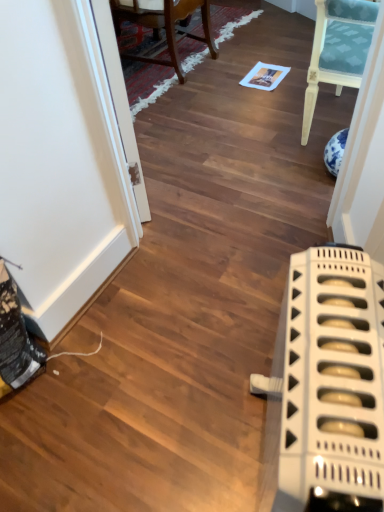
What do you see at coordinates (116, 94) in the screenshot? The width and height of the screenshot is (384, 512). I see `transparent glass door at upper left` at bounding box center [116, 94].

You are a GUI agent. You are given a task and a screenshot of the screen. Output one action in this format:
    pyautogui.click(x=<x>, y=<y>)
    Task: Click on the white plastic radiator at lower right
    Image resolution: width=384 pixels, height=512 pixels.
    Given the screenshot: What is the action you would take?
    pyautogui.click(x=332, y=379)

Locate an element on the screen. wooden chair at upper center is located at coordinates (165, 27).

Considering the relative sizes of white plastic radiator at lower right and transparent glass door at upper left in the image provided, is white plastic radiator at lower right wider than transparent glass door at upper left?

Yes, white plastic radiator at lower right is wider than transparent glass door at upper left.

Looking at this image, is white plastic radiator at lower right completely or partially outside of transparent glass door at upper left?

Indeed, white plastic radiator at lower right is completely outside transparent glass door at upper left.

Identify the location of appliance in front of the transparent glass door at upper left. (332, 379).

Considering the positions of objects white plastic radiator at lower right and transparent glass door at upper left in the image provided, who is more to the left, white plastic radiator at lower right or transparent glass door at upper left?

From the viewer's perspective, transparent glass door at upper left appears more on the left side.

Which is more distant, (156, 61) or (109, 18)?

Point (156, 61)

In the scene shown: Is transparent glass door at upper left inside wooden chair at upper center?

No, wooden chair at upper center does not contain transparent glass door at upper left.

From a real-world perspective, between wooden chair at upper center and transparent glass door at upper left, who is vertically lower?

In real-world perspective, wooden chair at upper center is lower.

Considering the relative sizes of wooden chair at upper center and transparent glass door at upper left in the image provided, is wooden chair at upper center taller than transparent glass door at upper left?

In fact, wooden chair at upper center may be shorter than transparent glass door at upper left.

Locate an element on the screen. chair that is behind the transparent glass door at upper left is located at coordinates (165, 27).

Considering the sizes of objects transparent glass door at upper left and wooden chair at upper center in the image provided, who is shorter, transparent glass door at upper left or wooden chair at upper center?

wooden chair at upper center.

Are transparent glass door at upper left and white plastic radiator at lower right located far from each other?

No, transparent glass door at upper left is not far from white plastic radiator at lower right.

Between transparent glass door at upper left and white plastic radiator at lower right, which one has smaller width?

transparent glass door at upper left is thinner.

Looking at this image, considering the relative sizes of transparent glass door at upper left and white plastic radiator at lower right in the image provided, is transparent glass door at upper left smaller than white plastic radiator at lower right?

Yes.

Is transparent glass door at upper left positioned beyond the bounds of white plastic radiator at lower right?

Yes, transparent glass door at upper left is outside of white plastic radiator at lower right.

In terms of width, does wooden chair at upper center look wider or thinner when compared to white plastic radiator at lower right?

Considering their sizes, wooden chair at upper center looks broader than white plastic radiator at lower right.

Is wooden chair at upper center completely or partially outside of white plastic radiator at lower right?

wooden chair at upper center lies outside white plastic radiator at lower right's area.

From the image's perspective, would you say wooden chair at upper center is positioned over white plastic radiator at lower right?

Indeed, from the image's perspective, wooden chair at upper center is shown above white plastic radiator at lower right.

From a real-world perspective, who is located lower, wooden chair at upper center or white plastic radiator at lower right?

wooden chair at upper center.

Which is closer to the camera, (296, 473) or (211, 37)?

Positioned in front is point (296, 473).

Is white plastic radiator at lower right looking in the opposite direction of wooden chair at upper center?

white plastic radiator at lower right is not turned away from wooden chair at upper center.

Looking at the image, does white plastic radiator at lower right seem bigger or smaller compared to wooden chair at upper center?

Clearly, white plastic radiator at lower right is smaller in size than wooden chair at upper center.

Which of these two, white plastic radiator at lower right or wooden chair at upper center, is wider?

With larger width is wooden chair at upper center.

Where is `appliance below the transparent glass door at upper left (from a real-world perspective)`? This screenshot has height=512, width=384. appliance below the transparent glass door at upper left (from a real-world perspective) is located at coordinates (332, 379).

Where is `chair behind the transparent glass door at upper left`? This screenshot has width=384, height=512. chair behind the transparent glass door at upper left is located at coordinates (165, 27).

From the image, which object appears to be nearer to white plastic radiator at lower right, transparent glass door at upper left or wooden chair at upper center?

transparent glass door at upper left lies closer to white plastic radiator at lower right than the other object.

Which object lies nearer to the anchor point transparent glass door at upper left, white plastic radiator at lower right or wooden chair at upper center?

white plastic radiator at lower right is closer to transparent glass door at upper left.

When comparing their distances from wooden chair at upper center, does transparent glass door at upper left or white plastic radiator at lower right seem closer?

Based on the image, transparent glass door at upper left appears to be nearer to wooden chair at upper center.

Estimate the real-world distances between objects in this image. Which object is closer to wooden chair at upper center, white plastic radiator at lower right or transparent glass door at upper left?

Among the two, transparent glass door at upper left is located nearer to wooden chair at upper center.

Looking at the image, which one is located closer to transparent glass door at upper left, wooden chair at upper center or white plastic radiator at lower right?

Based on the image, white plastic radiator at lower right appears to be nearer to transparent glass door at upper left.

When comparing their distances from white plastic radiator at lower right, does wooden chair at upper center or transparent glass door at upper left seem closer?

transparent glass door at upper left is closer to white plastic radiator at lower right.

I want to click on glass door between wooden chair at upper center and white plastic radiator at lower right in the vertical direction, so click(x=116, y=94).